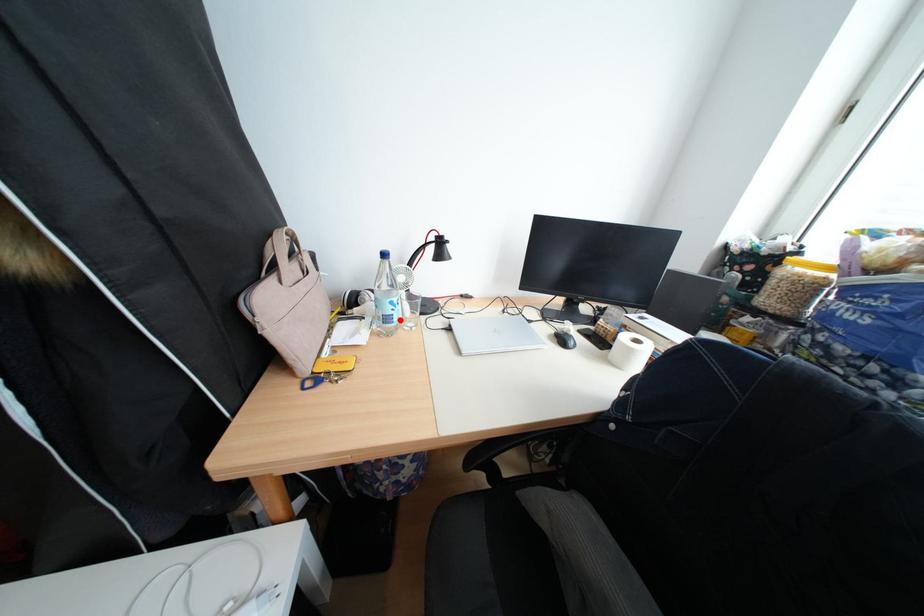
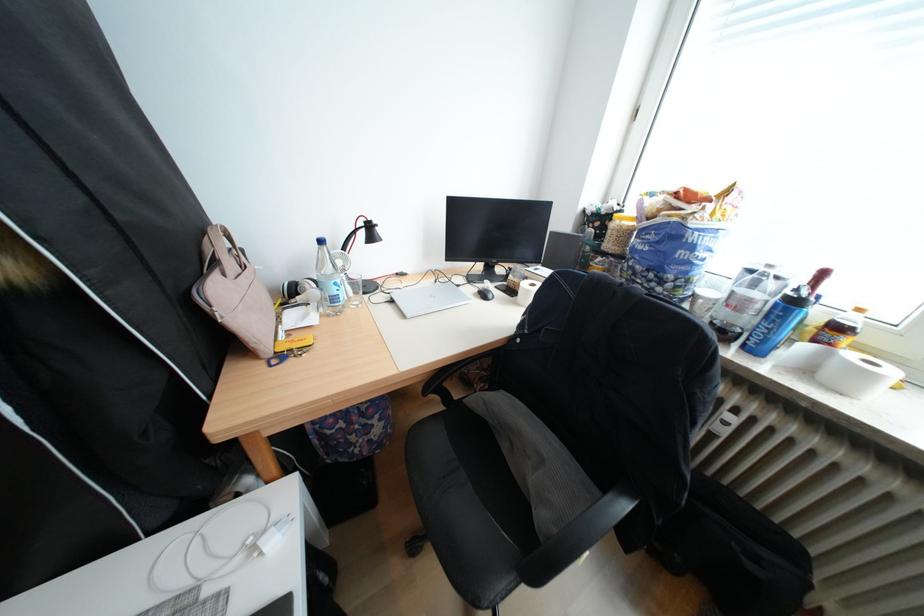
Question: I am providing you with two images of the same scene from different viewpoints. A red point is marked on the first image. Is the red point's position out of view in image 2?

Choices:
 (A) Yes
 (B) No

Answer: (B)